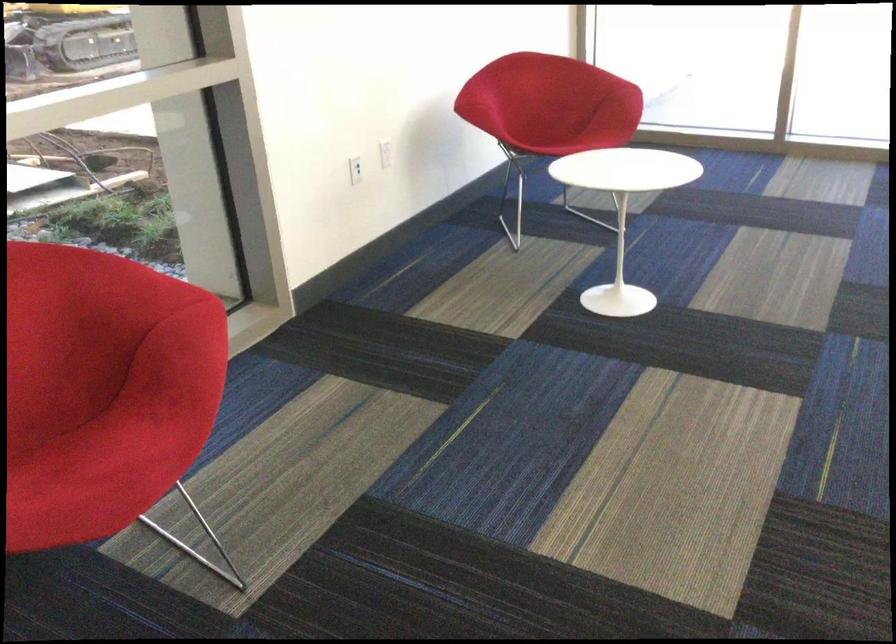
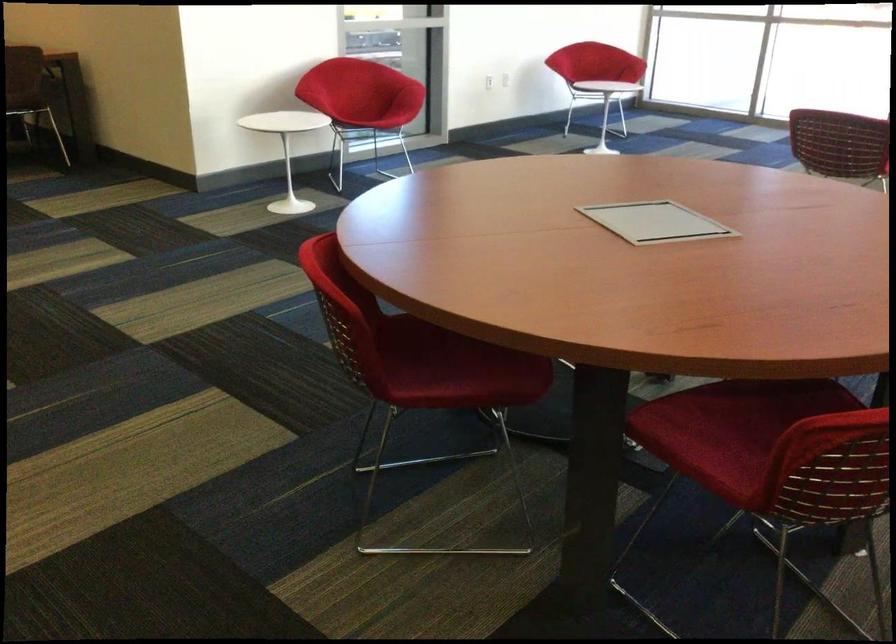
Find the pixel in the second image that matches [162,354] in the first image.

(406, 87)